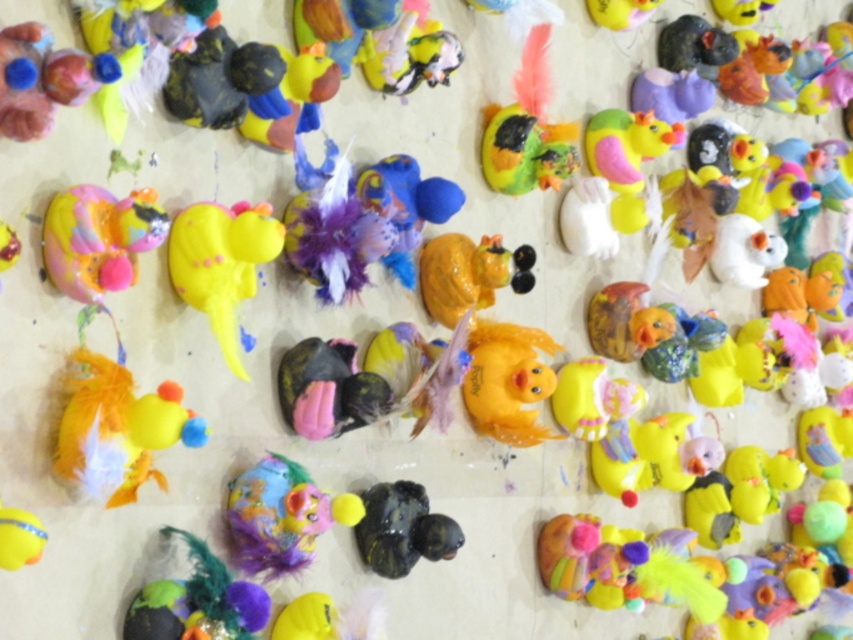
You are an art curator arranging a new exhibition. You have a matte yellow duckling at lower left that needs to be placed exactly at point [119,429]. Can you confirm if the current arrangement already has an object at that coordinate?

Yes, the matte yellow duckling at lower left is already located at point [119,429].

You are arranging a display of duck figurines and need to ensure that the yellow matte rubber duck at center is visible. Is the multicolored clay duckling at center blocking its view from the front?

The yellow matte rubber duck at center is in front of the multicolored clay duckling at center, so it is not blocked and remains visible from the front.

You are organizing a display of duck figurines and need to place a small vase between the matte orange rubber duck at center and the shiny black duck at center. Since the vase is 10 cm tall, will it fit between them vertically?

The matte orange rubber duck at center is taller than the shiny black duck at center, so the height difference between them must be considered. However, the exact height of each duck isn t provided, so it s impossible to determine if the 10 cm vase will fit vertically between them.